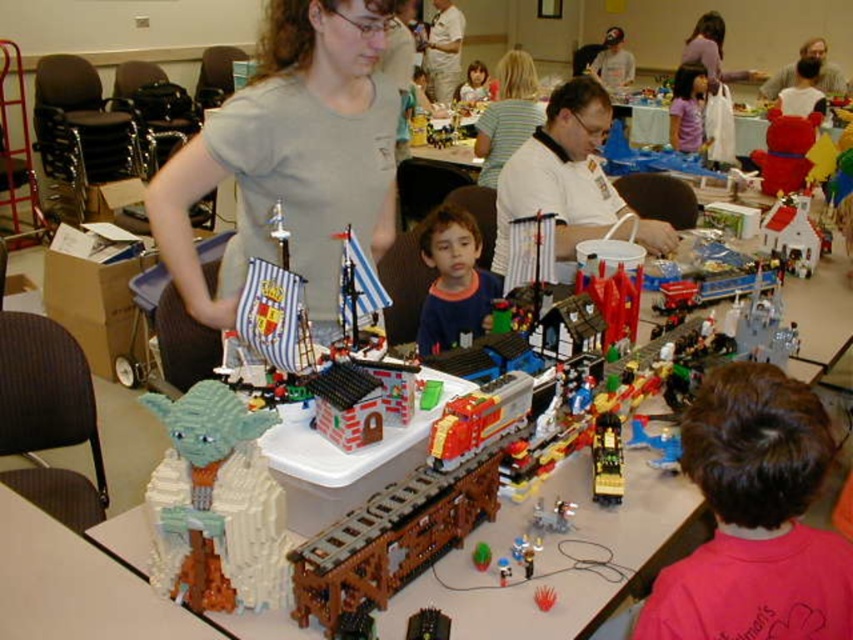
You are organizing a photo shoot and need to ensure that the brown hair at lower right and the red plush bear at upper right are both visible in the frame. Given their sizes, which object might require you to adjust your camera angle to include it properly?

The red plush bear at upper right requires adjusting the camera angle because it occupies more space than the brown hair at lower right, so it might take up more of the frame.

You are a photographer taking a picture of the LEGO display. You notice two shirts in the background, the striped fabric shirt at center and the smooth pink shirt at upper center. Which shirt is shorter in height?

The striped fabric shirt at center is not as tall as the smooth pink shirt at upper center, so the striped fabric shirt at center is shorter in height.

You are a photographer at the event and need to capture a clear shot of both the brown hair at lower right and the red plush bear at upper right. Given their sizes, which object might require you to adjust your camera focus more carefully to ensure clarity?

The brown hair at lower right is thinner than the red plush bear at upper right, so the brown hair at lower right might require more careful focus adjustment due to its smaller size.